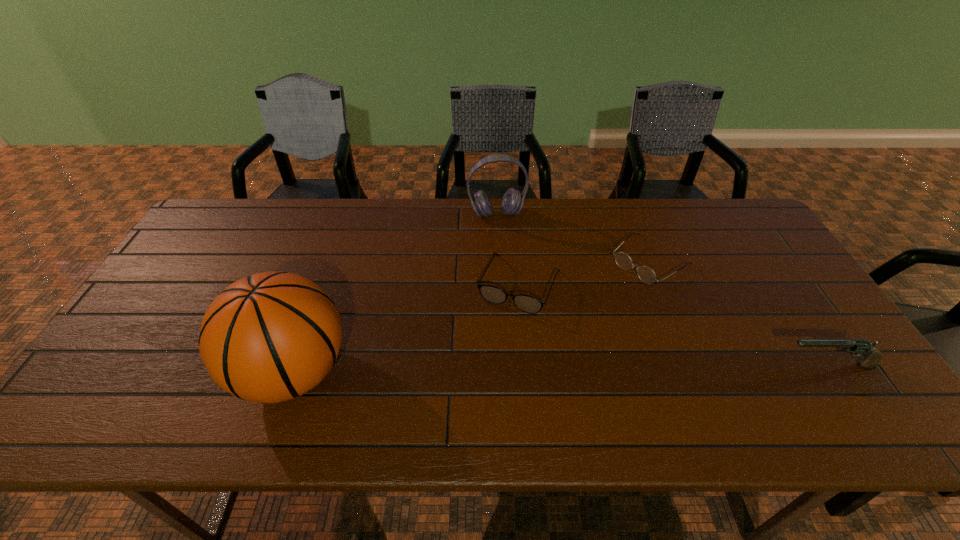
Locate an element on the screen. Image resolution: width=960 pixels, height=540 pixels. unoccupied area between the headset and the left spectacles is located at coordinates (508, 249).

Locate an element on the screen. This screenshot has width=960, height=540. unoccupied area between the second tallest object and the shorter spectacles is located at coordinates (573, 237).

Where is `vacant space in between the rightmost object and the left spectacles`? Image resolution: width=960 pixels, height=540 pixels. vacant space in between the rightmost object and the left spectacles is located at coordinates (674, 325).

Where is `empty space between the left spectacles and the tallest object`? The height and width of the screenshot is (540, 960). empty space between the left spectacles and the tallest object is located at coordinates (406, 329).

Locate an element on the screen. free spot between the tallest object and the second tallest object is located at coordinates (396, 293).

Identify the location of object identified as the fourth closest to the right spectacles. The height and width of the screenshot is (540, 960). (270, 337).

Identify which object is the fourth nearest to the leftmost object. Please provide its 2D coordinates. Your answer should be formatted as a tuple, i.e. [(x, y)], where the tuple contains the x and y coordinates of a point satisfying the conditions above.

[(860, 347)]

This screenshot has height=540, width=960. Find the location of `vacant space that satisfies the following two spatial constraints: 1. on the back side of the leftmost object; 2. on the right side of the fourth shortest object`. vacant space that satisfies the following two spatial constraints: 1. on the back side of the leftmost object; 2. on the right side of the fourth shortest object is located at coordinates (348, 214).

You are a GUI agent. You are given a task and a screenshot of the screen. Output one action in this format:
    pyautogui.click(x=<x>, y=<y>)
    Task: Click on the vacant space that satisfies the following two spatial constraints: 1. on the back side of the tallest object; 2. aiming along the barrel of the rightmost object
    This screenshot has height=540, width=960.
    Given the screenshot: What is the action you would take?
    pyautogui.click(x=296, y=365)